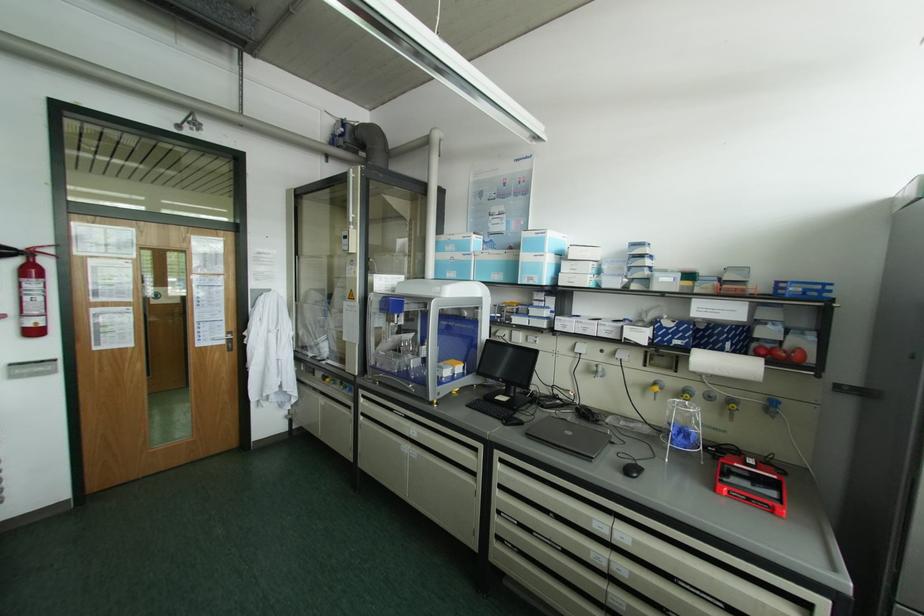
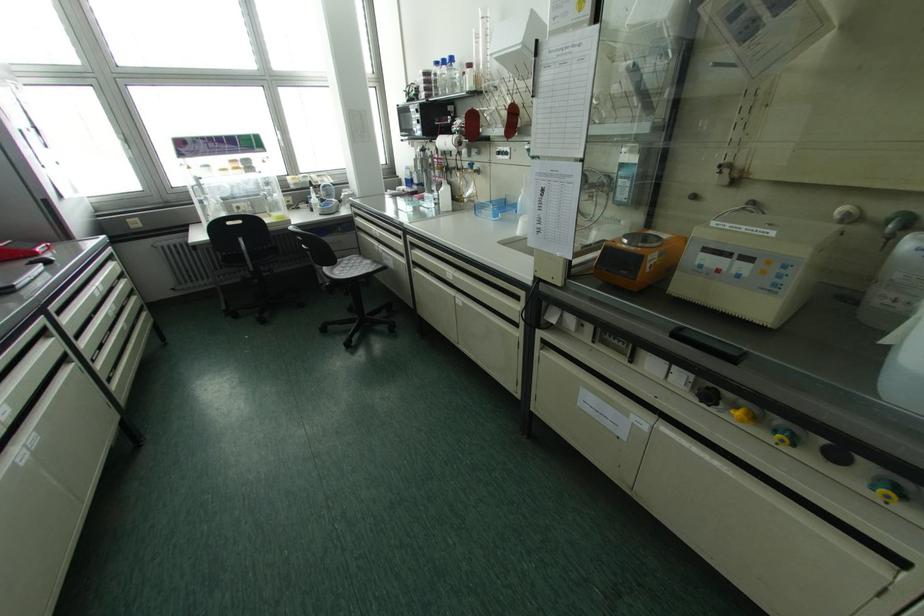
In the second image, find the point that corresponds to (x=630, y=469) in the first image.

(40, 262)